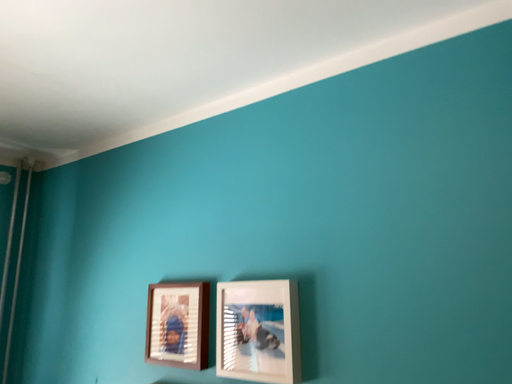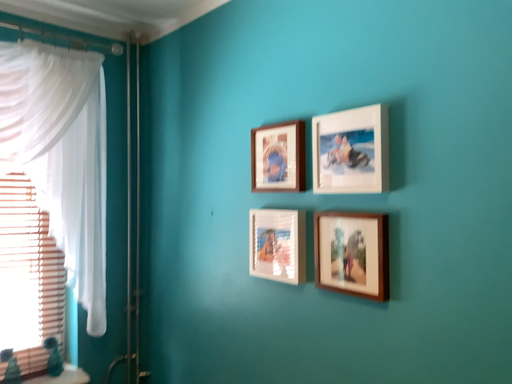
Question: How did the camera likely rotate when shooting the video?

Choices:
 (A) rotated right
 (B) rotated left

Answer: (B)